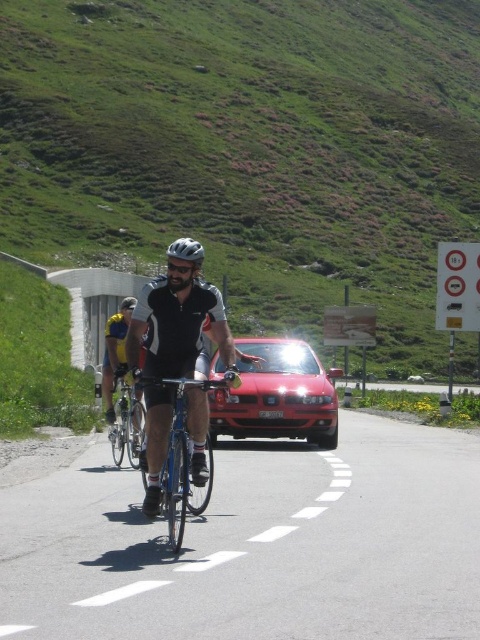
Describe the element at coordinates (256, 545) in the screenshot. The height and width of the screenshot is (640, 480). I see `blue metallic bicycle at center` at that location.

Who is taller, blue metallic bicycle at center or shiny red car at center?

shiny red car at center is taller.

Where is `blue metallic bicycle at center`? Image resolution: width=480 pixels, height=640 pixels. blue metallic bicycle at center is located at coordinates (256, 545).

Is shiny blue bicycle at center taller than silver metallic bicycle at center?

Yes.

Between shiny blue bicycle at center and silver metallic bicycle at center, which one is positioned lower?

Positioned lower is shiny blue bicycle at center.

This screenshot has width=480, height=640. I want to click on shiny blue bicycle at center, so click(x=180, y=458).

Can you confirm if matte black cycling outfit at center is positioned to the right of matte black helmet at center?

Indeed, matte black cycling outfit at center is positioned on the right side of matte black helmet at center.

Which is in front, point (192, 369) or point (189, 253)?

Positioned in front is point (189, 253).

Which is in front, point (171, 376) or point (186, 253)?

Positioned in front is point (186, 253).

At what (x,y) coordinates should I click in order to perform the action: click on matte black cycling outfit at center. Please return your answer as a coordinate pair (x, y). Looking at the image, I should click on (178, 324).